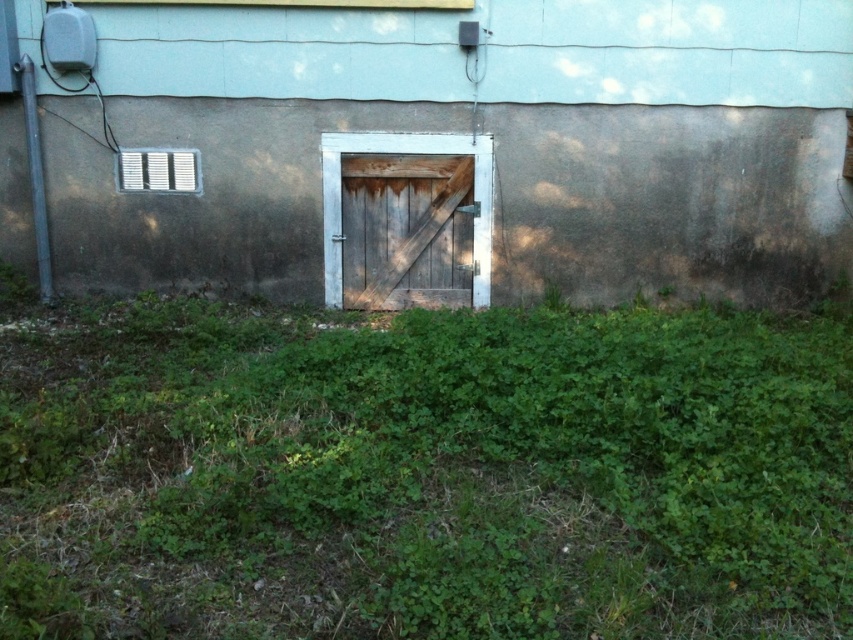
Question: Is rusty wood door at center thinner than weathered wood barn door at center?

Choices:
 (A) yes
 (B) no

Answer: (B)

Question: In this image, where is green leafy grass at center located relative to rusty wood door at center?

Choices:
 (A) left
 (B) right

Answer: (A)

Question: Estimate the real-world distances between objects in this image. Which object is farther from the weathered wood barn door at center?

Choices:
 (A) green leafy grass at center
 (B) rusty wood door at center

Answer: (A)

Question: Which of the following is the closest to the observer?

Choices:
 (A) (x=467, y=140)
 (B) (x=769, y=465)

Answer: (B)

Question: Is rusty wood door at center closer to the viewer compared to weathered wood barn door at center?

Choices:
 (A) no
 (B) yes

Answer: (B)

Question: Among these points, which one is farthest from the camera?

Choices:
 (A) (325, 173)
 (B) (88, 572)

Answer: (A)